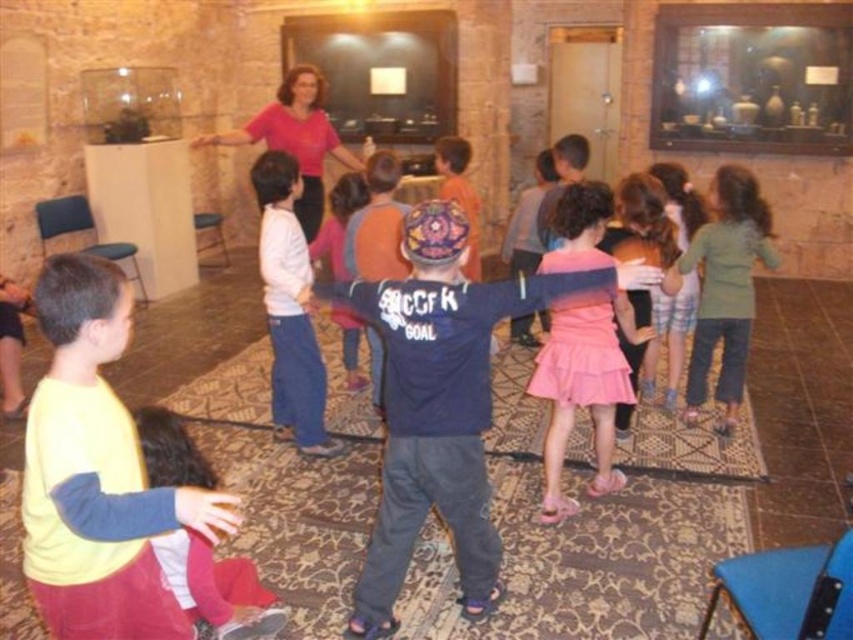
The width and height of the screenshot is (853, 640). What do you see at coordinates (97, 474) in the screenshot?
I see `yellow long-sleeve shirt at lower left` at bounding box center [97, 474].

Locate an element on the screen. yellow long-sleeve shirt at lower left is located at coordinates point(97,474).

Is yellow long-sleeve shirt at lower left further to the viewer compared to green cotton shirt at center?

No, yellow long-sleeve shirt at lower left is closer to the viewer.

Is yellow long-sleeve shirt at lower left closer to camera compared to green cotton shirt at center?

Yes, it is in front of green cotton shirt at center.

Which is behind, point (44, 490) or point (735, 216)?

The point (735, 216) is behind.

The height and width of the screenshot is (640, 853). I want to click on yellow long-sleeve shirt at lower left, so click(x=97, y=474).

Is pink satin dress at center further to the viewer compared to green cotton shirt at center?

No, pink satin dress at center is in front of green cotton shirt at center.

Between pink satin dress at center and green cotton shirt at center, which one is positioned lower?

pink satin dress at center is lower down.

Is point (596, 388) positioned behind point (711, 310)?

No, it is in front of (711, 310).

The image size is (853, 640). What are the coordinates of `pink satin dress at center` in the screenshot? It's located at (583, 388).